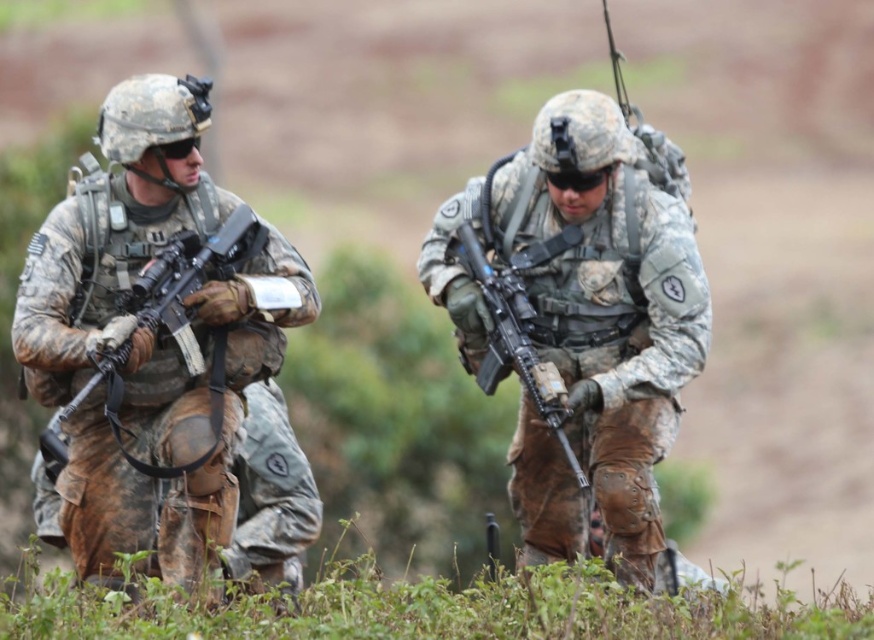
Question: Does camouflage uniform at left have a smaller size compared to matte black rifle at left?

Choices:
 (A) no
 (B) yes

Answer: (A)

Question: Is matte black rifle at left below matte black rifle at center?

Choices:
 (A) no
 (B) yes

Answer: (A)

Question: Estimate the real-world distances between objects in this image. Which object is farther from the matte black rifle at left?

Choices:
 (A) matte black rifle at center
 (B) camouflage uniform at center
 (C) camouflage uniform at left

Answer: (B)

Question: Which of these objects is positioned farthest from the matte black rifle at left?

Choices:
 (A) camouflage uniform at left
 (B) camouflage uniform at center
 (C) matte black rifle at center

Answer: (B)

Question: Does camouflage uniform at left appear under matte black rifle at left?

Choices:
 (A) yes
 (B) no

Answer: (A)

Question: Among these points, which one is farthest from the camera?

Choices:
 (A) (50, 452)
 (B) (108, 522)
 (C) (546, 362)
 (D) (706, 300)

Answer: (A)